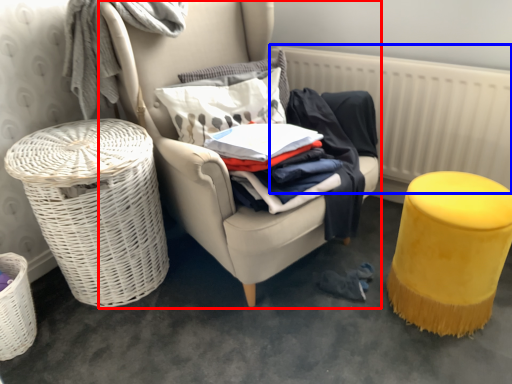
Question: Which point is closer to the camera, chair (highlighted by a red box) or radiator (highlighted by a blue box)?

Choices:
 (A) chair
 (B) radiator

Answer: (A)